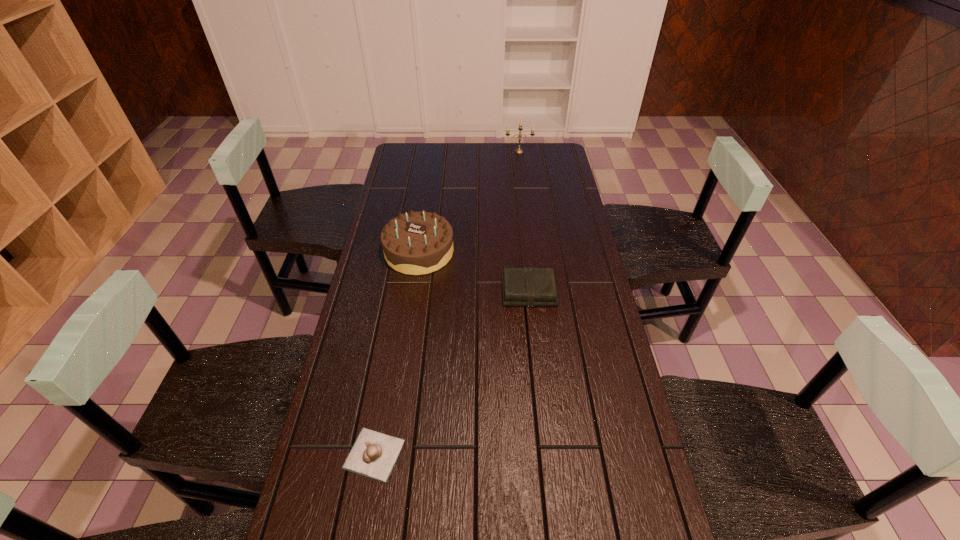
I want to click on candle, so click(518, 150).

Where is `the farthest object`? The width and height of the screenshot is (960, 540). the farthest object is located at coordinates (518, 150).

Image resolution: width=960 pixels, height=540 pixels. What are the coordinates of `birthday cake` in the screenshot? It's located at (x=416, y=243).

Identify the location of the third shortest object. (416, 243).

The height and width of the screenshot is (540, 960). In order to click on book in this screenshot , I will do `click(528, 286)`.

The width and height of the screenshot is (960, 540). What are the coordinates of `the second nearest object` in the screenshot? It's located at (528, 286).

Image resolution: width=960 pixels, height=540 pixels. I want to click on the shortest object, so click(x=374, y=454).

Where is `the nearest object`? the nearest object is located at coordinates (374, 454).

Image resolution: width=960 pixels, height=540 pixels. I want to click on free location located on the front of the farthest object, so click(x=523, y=185).

Identify the location of vacant space located on the front-facing side of the birthday cake. (407, 335).